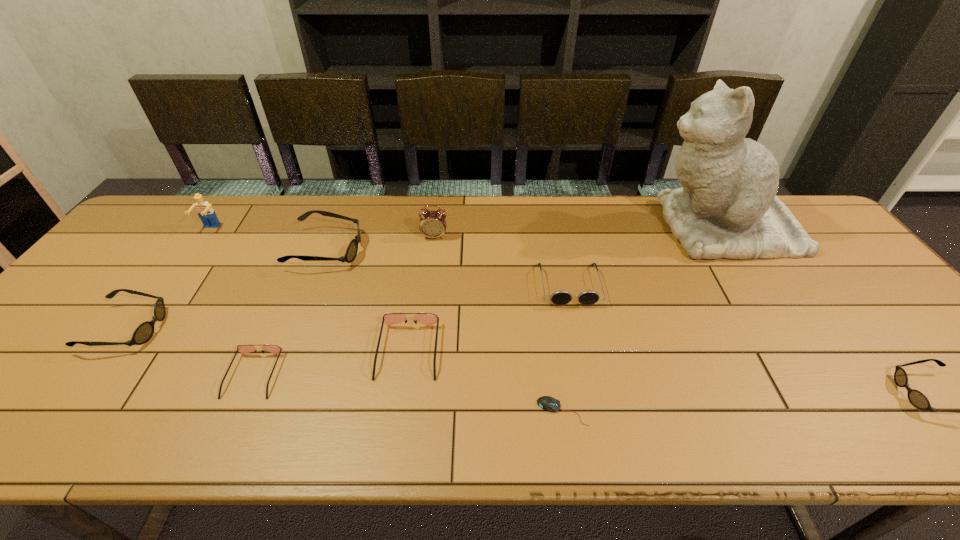
You are a GUI agent. You are given a task and a screenshot of the screen. Output one action in this format:
    pyautogui.click(x=<x>, y=<y>)
    Task: Click on the cat
    
    Given the screenshot: What is the action you would take?
    pyautogui.click(x=727, y=207)

Find the location of a particular element. The image size is (960, 540). blue Lego is located at coordinates (206, 213).

The width and height of the screenshot is (960, 540). In order to click on alarm clock in this screenshot , I will do `click(432, 224)`.

Identify the location of the second black sunglasses from left to right. click(x=352, y=249).

Image resolution: width=960 pixels, height=540 pixels. Identify the location of the seventh shortest object. (352, 249).

At what (x,y) coordinates should I click in order to perform the action: click on the fifth sunglasses from left to right. Please return your answer as a coordinate pair (x, y). The height and width of the screenshot is (540, 960). Looking at the image, I should click on (561, 297).

Where is `the leftmost sunglasses`? the leftmost sunglasses is located at coordinates tap(144, 332).

Image resolution: width=960 pixels, height=540 pixels. In order to click on the leftmost black sunglasses in this screenshot , I will do `click(144, 332)`.

The image size is (960, 540). I want to click on the bigger pink sunglasses, so click(389, 318).

The height and width of the screenshot is (540, 960). I want to click on the right pink sunglasses, so click(389, 318).